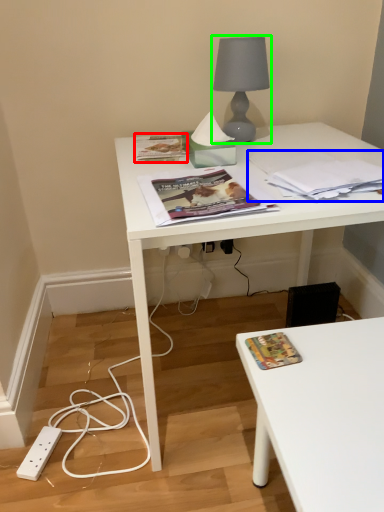
Question: Considering the real-world distances, which object is closest to paperback book (highlighted by a red box)? paperback book (highlighted by a blue box) or lamp (highlighted by a green box).

Choices:
 (A) paperback book
 (B) lamp

Answer: (B)